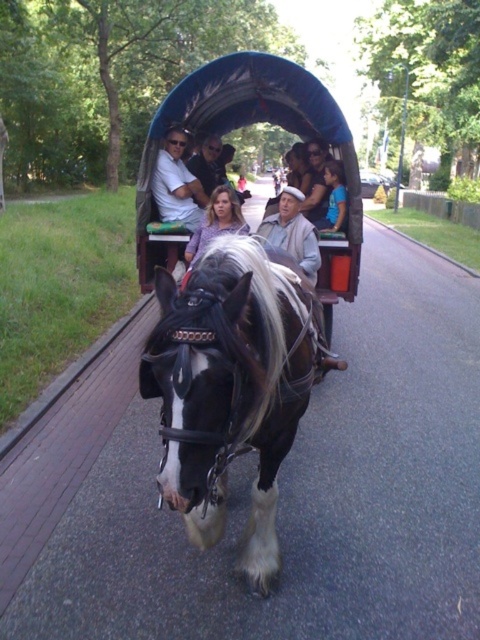
You are a photographer standing on the sidewalk next to the road. You want to take a photo of the shiny blue fabric cart at center and the matte white shirt at center. How far apart are these two objects in the image?

The shiny blue fabric cart at center is 66.88 centimeters from matte white shirt at center.

You are standing at the origin point of the coordinate system where the road starts. The black glossy horse at center is located at point 0.606, 0.477. If you want to walk towards the horse, which direction should you move in?

The black glossy horse at center is located at coordinate point (228, 387). Since you are at the origin point, you should move northeast to reach the horse.